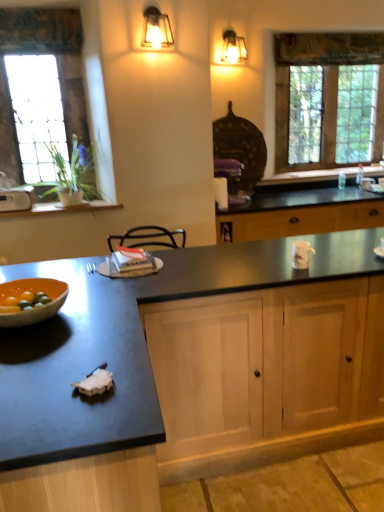
Question: In terms of width, does black granite countertop at center look wider or thinner when compared to metallic lantern at upper center, acting as the 1th light fixture starting from the front?

Choices:
 (A) wide
 (B) thin

Answer: (A)

Question: Is black granite countertop at center to the left or to the right of metallic lantern at upper center, arranged as the 1th light fixture when ordered from the bottom, in the image?

Choices:
 (A) left
 (B) right

Answer: (A)

Question: Which object is the closest to the orange matte bowl at left?

Choices:
 (A) light wood cabinet at center
 (B) wooden window sill at lower left
 (C) metallic wall sconce at upper center, the 1th light fixture from the top
 (D) metallic lantern at upper center, arranged as the 1th light fixture when ordered from the bottom
 (E) clear glass window at left, the second window from the right

Answer: (A)

Question: Which is nearer to the black granite countertop at center?

Choices:
 (A) clear glass window at upper right, which is counted as the second window, starting from the front
 (B) metallic wall sconce at upper center, which is the 2th light fixture from front to back
 (C) orange matte bowl at left
 (D) clear glass window at left, the second window from the right
 (E) metallic lantern at upper center, the second light fixture when ordered from right to left

Answer: (C)